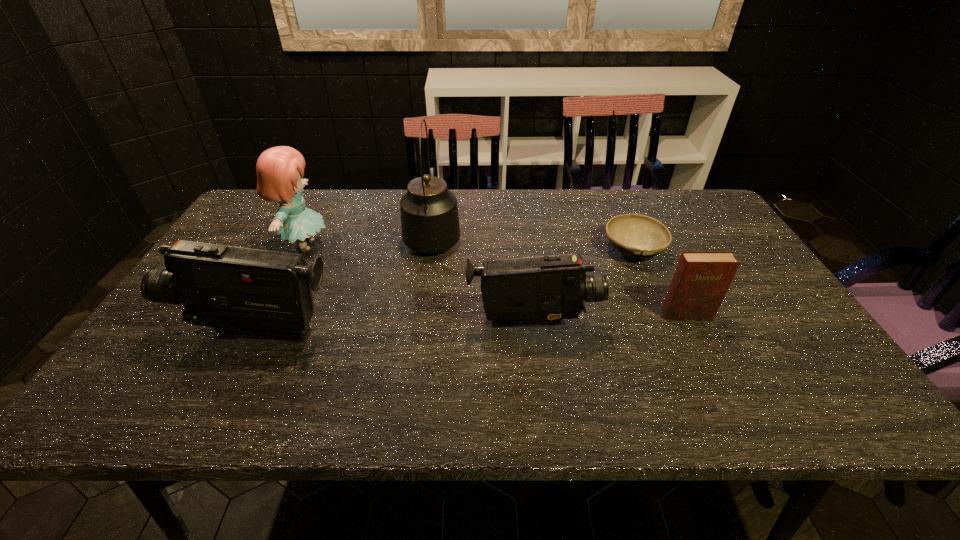
Where is `the fourth shortest object`? This screenshot has height=540, width=960. the fourth shortest object is located at coordinates (238, 291).

Where is `the left camcorder`? This screenshot has width=960, height=540. the left camcorder is located at coordinates click(x=238, y=291).

Locate an element on the screen. This screenshot has width=960, height=540. the shorter camcorder is located at coordinates (543, 290).

Where is `the third object from right to left`? The image size is (960, 540). the third object from right to left is located at coordinates (543, 290).

Image resolution: width=960 pixels, height=540 pixels. In order to click on doll in this screenshot , I will do `click(279, 169)`.

Find the location of a particular element. This screenshot has width=960, height=540. the third object from left to right is located at coordinates (430, 224).

This screenshot has height=540, width=960. I want to click on the tallest object, so click(430, 224).

Locate an element on the screen. The height and width of the screenshot is (540, 960). diary is located at coordinates (701, 280).

The height and width of the screenshot is (540, 960). I want to click on bowl, so click(x=639, y=236).

This screenshot has height=540, width=960. Identify the location of vacant space located 0.060m on the front-facing side of the left camcorder. (154, 332).